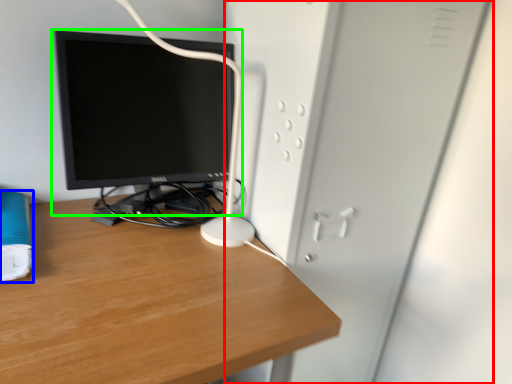
Question: Estimate the real-world distances between objects in this image. Which object is farther from file cabinet (highlighted by a red box), paperback book (highlighted by a blue box) or computer monitor (highlighted by a green box)?

Choices:
 (A) paperback book
 (B) computer monitor

Answer: (A)